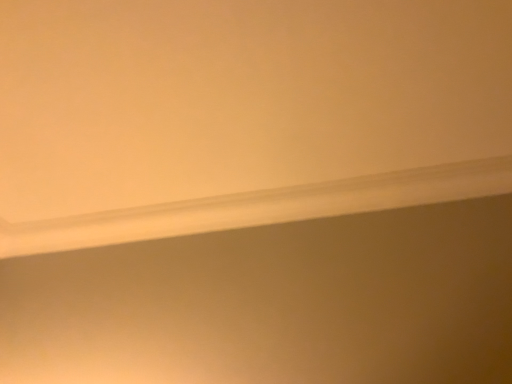
Measure the distance between point [342,207] and camera.

The depth of point [342,207] is 1.46 meters.

Where is `white smooth window sill at upper center`? This screenshot has width=512, height=384. white smooth window sill at upper center is located at coordinates (261, 207).

In order to face white smooth window sill at upper center, should I rotate leftwards or rightwards?

Turn left by 2.061 degrees to look at white smooth window sill at upper center.

Image resolution: width=512 pixels, height=384 pixels. Describe the element at coordinates (261, 207) in the screenshot. I see `white smooth window sill at upper center` at that location.

You are a GUI agent. You are given a task and a screenshot of the screen. Output one action in this format:
    pyautogui.click(x=<x>, y=<y>)
    Task: Click on the white smooth window sill at upper center
    The height and width of the screenshot is (384, 512).
    Given the screenshot: What is the action you would take?
    pyautogui.click(x=261, y=207)